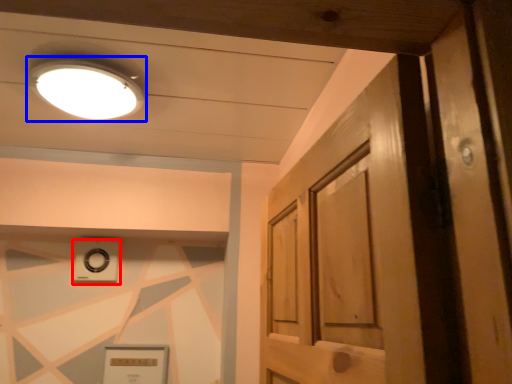
Question: Which point is closer to the camera, knob (highlighted by a red box) or lighting (highlighted by a blue box)?

Choices:
 (A) knob
 (B) lighting

Answer: (B)